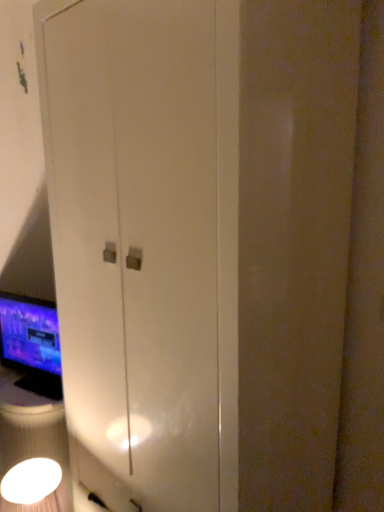
Question: Is matte black monitor at left touching white glossy light fixture at lower left?

Choices:
 (A) no
 (B) yes

Answer: (A)

Question: From a real-world perspective, is matte black monitor at left positioned over white glossy light fixture at lower left based on gravity?

Choices:
 (A) yes
 (B) no

Answer: (A)

Question: Considering the relative positions of matte black monitor at left and white glossy light fixture at lower left in the image provided, is matte black monitor at left to the right of white glossy light fixture at lower left from the viewer's perspective?

Choices:
 (A) yes
 (B) no

Answer: (B)

Question: From the image's perspective, is matte black monitor at left beneath white glossy light fixture at lower left?

Choices:
 (A) no
 (B) yes

Answer: (A)

Question: Does matte black monitor at left have a greater height compared to white glossy light fixture at lower left?

Choices:
 (A) no
 (B) yes

Answer: (B)

Question: Is matte black monitor at left bigger than white glossy light fixture at lower left?

Choices:
 (A) yes
 (B) no

Answer: (B)

Question: Is white glossy light fixture at lower left taller than matte black monitor at left?

Choices:
 (A) no
 (B) yes

Answer: (A)

Question: From the image's perspective, is white glossy light fixture at lower left located above matte black monitor at left?

Choices:
 (A) yes
 (B) no

Answer: (B)

Question: From a real-world perspective, is white glossy light fixture at lower left located higher than matte black monitor at left?

Choices:
 (A) no
 (B) yes

Answer: (A)

Question: Is white glossy light fixture at lower left aimed at matte black monitor at left?

Choices:
 (A) yes
 (B) no

Answer: (B)

Question: Is white glossy light fixture at lower left located outside matte black monitor at left?

Choices:
 (A) no
 (B) yes

Answer: (B)

Question: From the image's perspective, would you say white glossy light fixture at lower left is shown under matte black monitor at left?

Choices:
 (A) no
 (B) yes

Answer: (B)

Question: Is point (6, 501) positioned closer to the camera than point (56, 344)?

Choices:
 (A) farther
 (B) closer

Answer: (B)